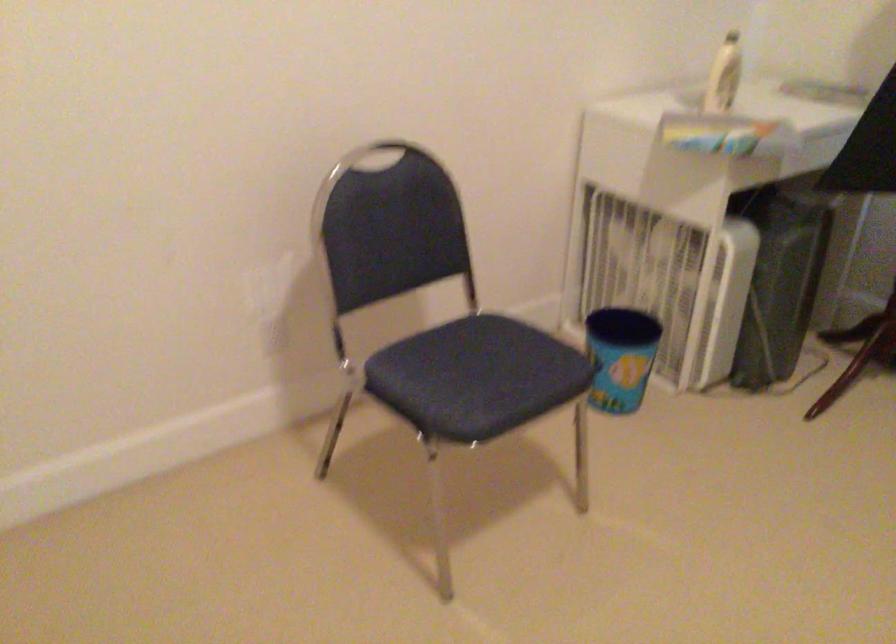
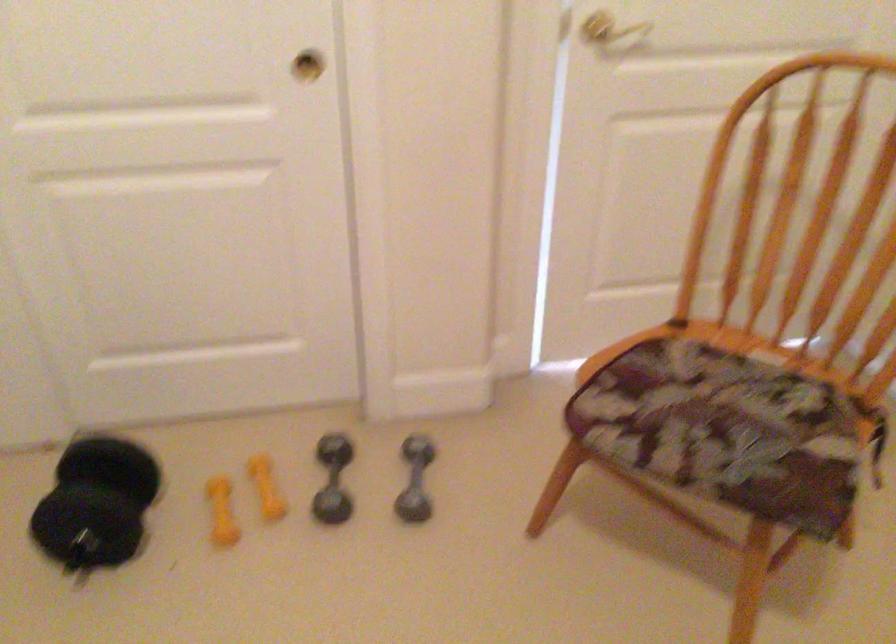
Based on the continuous images, in which direction is the camera rotating?

The camera rotated toward left-down.